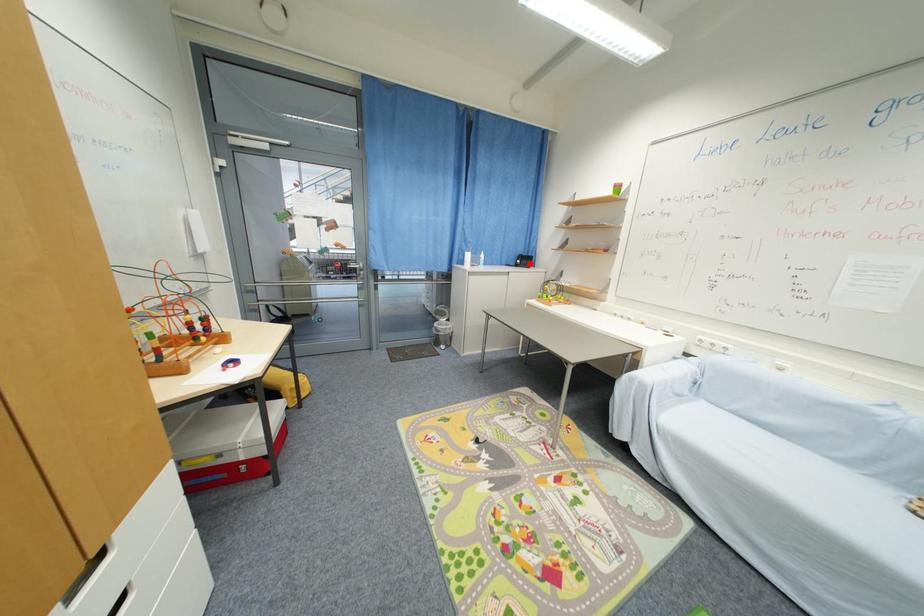
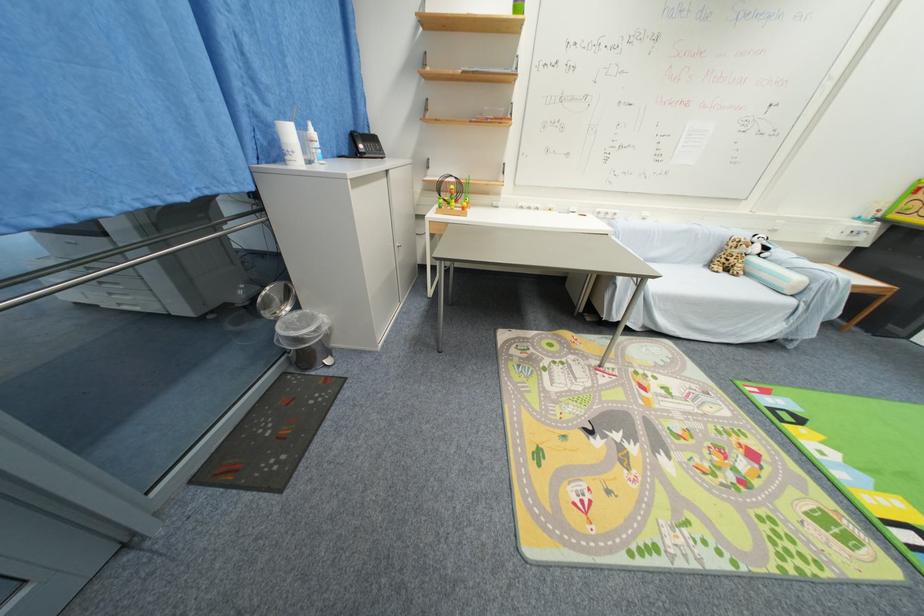
Locate, in the second image, the point that corresponds to the highlighted location in the first image.

(377, 148)